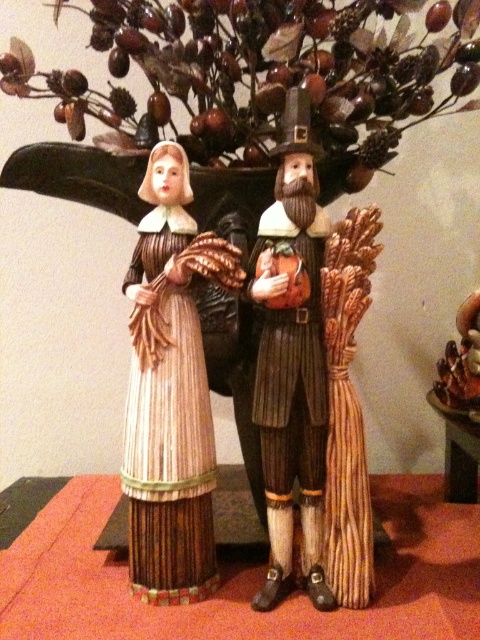
You are setting up a Thanksgiving display and have a small decorative plate that needs to be placed on the wooden table at center. The plate is 10 cm tall. Can the plate be placed on the table without touching the wooden pilgrim at center?

The wooden table at center has a lesser height compared to the wooden pilgrim at center, so the plate that is 10 cm tall may touch the pilgrim if placed on the table. Check the vertical clearance between the table and the pilgrim to ensure the plate doesn not interfere.

You are setting up a Thanksgiving display and notice two wooden figures in the center. Which one is placed lower in position between the wooden straw doll at center and the wooden pilgrim at center?

The wooden straw doll at center is positioned under the wooden pilgrim at center, so it is placed lower.

You are setting up a Thanksgiving display and need to place the brown textured tree at upper center and the wooden table at lower right. Based on their positions, which object is higher in the scene?

The brown textured tree at upper center is higher than the wooden table at lower right because it is positioned above it in the scene.